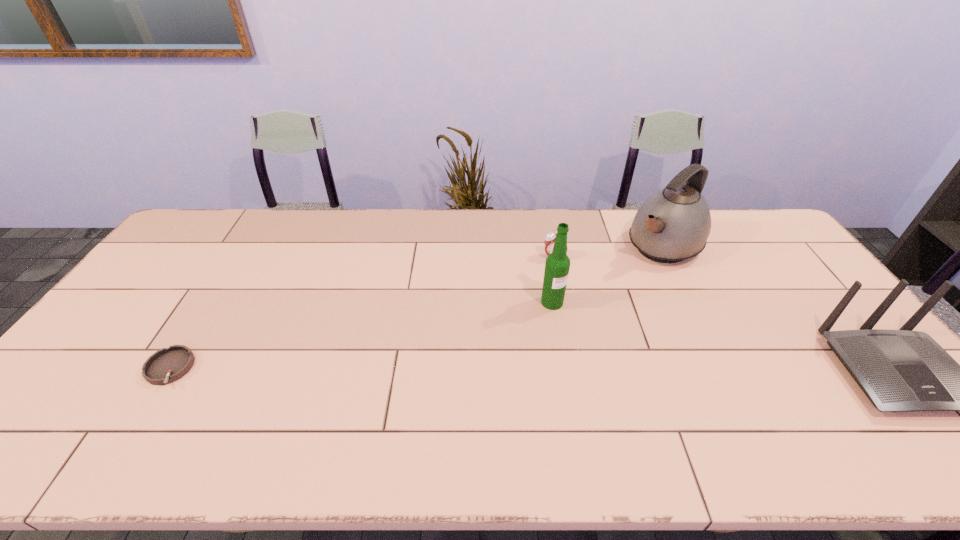
Find the location of `vacant space at the right edge of the desktop`. vacant space at the right edge of the desktop is located at coordinates (837, 386).

Locate an element on the screen. The image size is (960, 540). free region at the far left corner of the desktop is located at coordinates (245, 209).

At what (x,y) coordinates should I click in order to perform the action: click on empty location between the alarm clock and the leftmost object. Please return your answer as a coordinate pair (x, y). Looking at the image, I should click on (362, 313).

The image size is (960, 540). What are the coordinates of `free spot between the third nearest object and the ashtray` in the screenshot? It's located at (361, 335).

In order to click on unoccupied area between the alarm clock and the kettle in this screenshot , I will do point(609,252).

Locate an element on the screen. free space between the kettle and the third farthest object is located at coordinates (608, 274).

I want to click on free spot between the second object from right to left and the leftmost object, so click(417, 307).

What are the coordinates of `object identified as the fourth closest to the ashtray` in the screenshot? It's located at click(x=902, y=370).

Find the location of a particular element. Image resolution: width=960 pixels, height=540 pixels. object that stands as the fourth closest to the third tallest object is located at coordinates 167,365.

I want to click on free space that satisfies the following two spatial constraints: 1. on the back side of the second shortest object; 2. on the left side of the ashtray, so click(x=240, y=257).